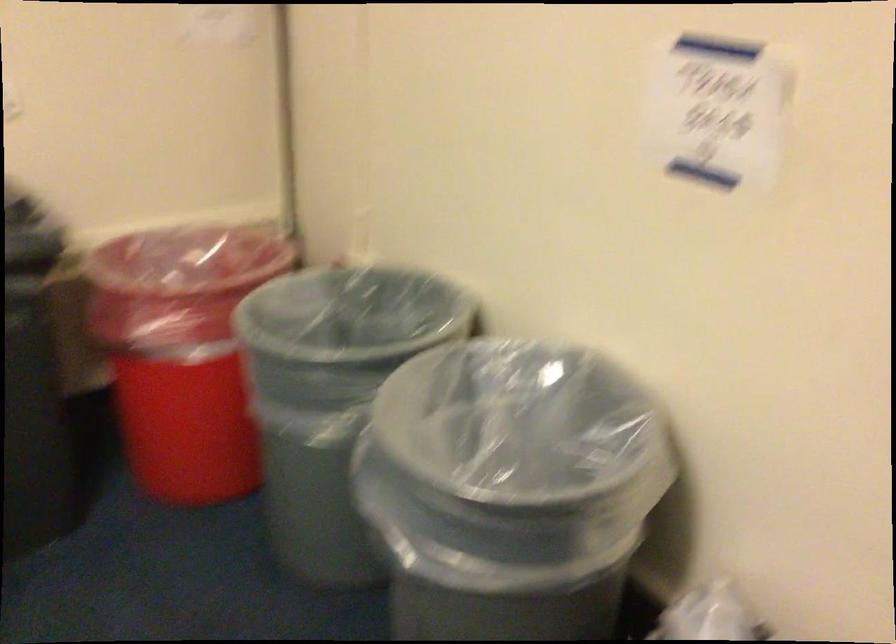
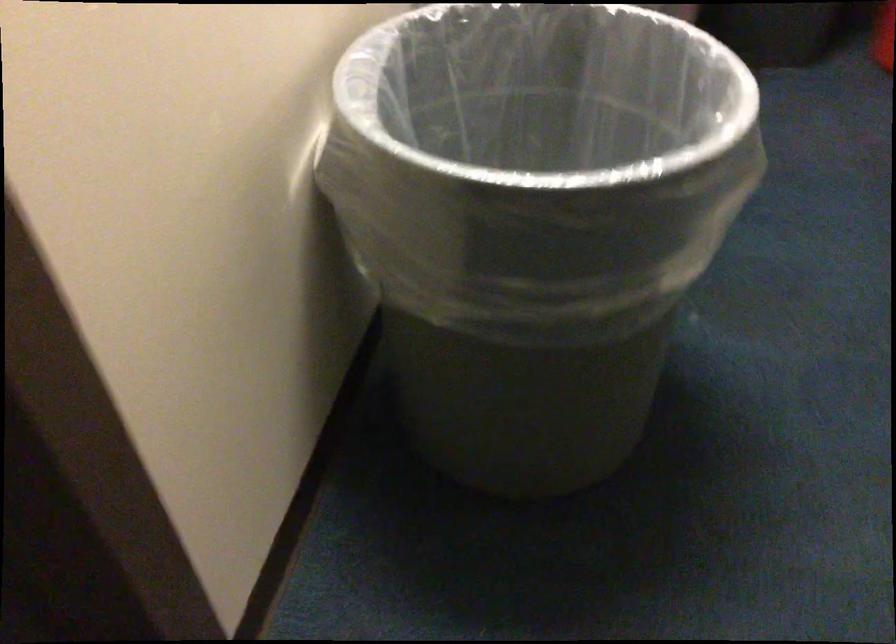
How did the camera likely rotate?

The camera rotated toward left-down.